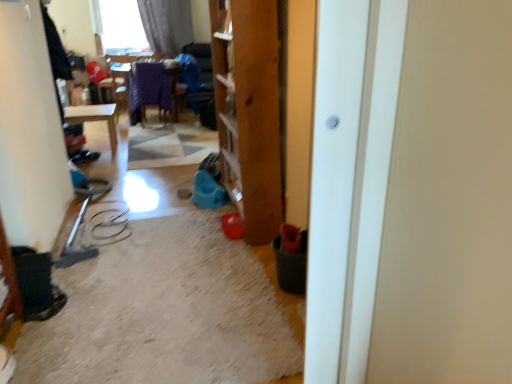
Question: Does white glossy door at center turn towards matte gray curtain at upper left?

Choices:
 (A) no
 (B) yes

Answer: (A)

Question: From the image's perspective, is white glossy door at center under matte gray curtain at upper left?

Choices:
 (A) no
 (B) yes

Answer: (B)

Question: Can you confirm if white glossy door at center is wider than matte gray curtain at upper left?

Choices:
 (A) yes
 (B) no

Answer: (A)

Question: From a real-world perspective, is white glossy door at center physically below matte gray curtain at upper left?

Choices:
 (A) no
 (B) yes

Answer: (B)

Question: Can we say white glossy door at center lies outside matte gray curtain at upper left?

Choices:
 (A) no
 (B) yes

Answer: (B)

Question: Can you confirm if white glossy door at center is thinner than matte gray curtain at upper left?

Choices:
 (A) no
 (B) yes

Answer: (A)

Question: Considering the relative sizes of matte gray curtain at upper left and white glossy door at center in the image provided, is matte gray curtain at upper left bigger than white glossy door at center?

Choices:
 (A) yes
 (B) no

Answer: (A)

Question: From a real-world perspective, is matte gray curtain at upper left located beneath white glossy door at center?

Choices:
 (A) no
 (B) yes

Answer: (A)

Question: Does matte gray curtain at upper left have a greater width compared to white glossy door at center?

Choices:
 (A) no
 (B) yes

Answer: (A)

Question: Can you confirm if matte gray curtain at upper left is positioned to the left of white glossy door at center?

Choices:
 (A) no
 (B) yes

Answer: (B)

Question: Considering the relative sizes of matte gray curtain at upper left and white glossy door at center in the image provided, is matte gray curtain at upper left taller than white glossy door at center?

Choices:
 (A) yes
 (B) no

Answer: (B)

Question: From the image's perspective, is matte gray curtain at upper left below white glossy door at center?

Choices:
 (A) no
 (B) yes

Answer: (A)

Question: From the image's perspective, is white glossy door at center above or below matte gray curtain at upper left?

Choices:
 (A) below
 (B) above

Answer: (A)